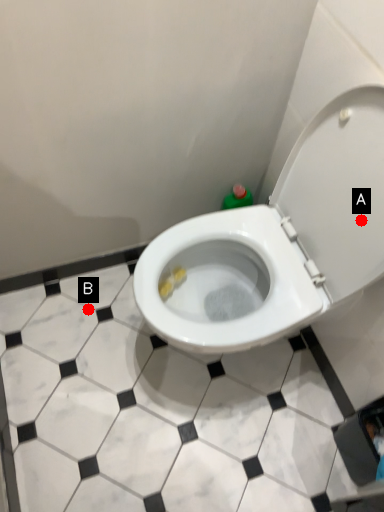
Question: Two points are circled on the image, labeled by A and B beside each circle. Which point is closer to the camera?

Choices:
 (A) A is closer
 (B) B is closer

Answer: (A)